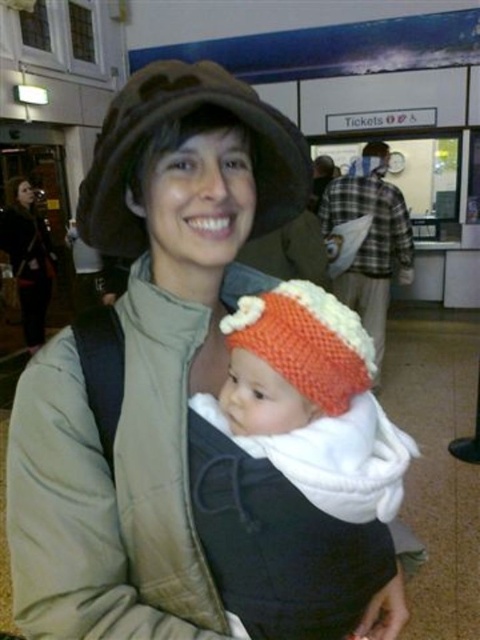
You are standing in the train station and want to take a photo of the ticket counter sign. You notice a point at coordinate (223, 70) that is 22.58 inches away from you. If your camera has a focal length of 50mm and you want to focus on that point, what distance should you set your camera to?

You should set your camera to focus at 22.58 inches because the point at coordinate (223, 70) is exactly that distance away from you.

You are a photographer standing at the center of the scene. You want to take a photo of the knitted orange hat at center. Which direction should you move to get the hat centered in your viewfinder?

The knitted orange hat at center is already at the center of the scene, so you don not need to move. Just point your camera directly at it.